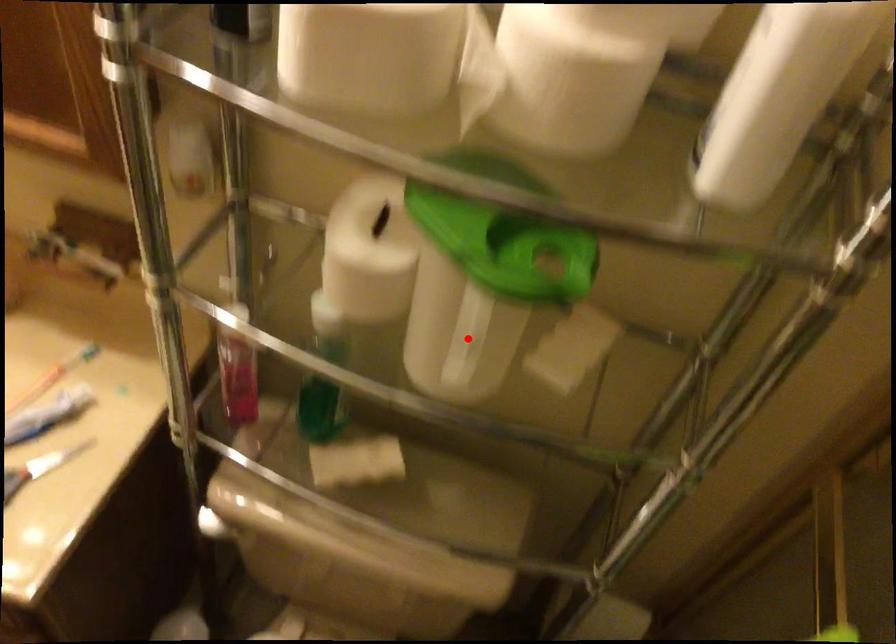
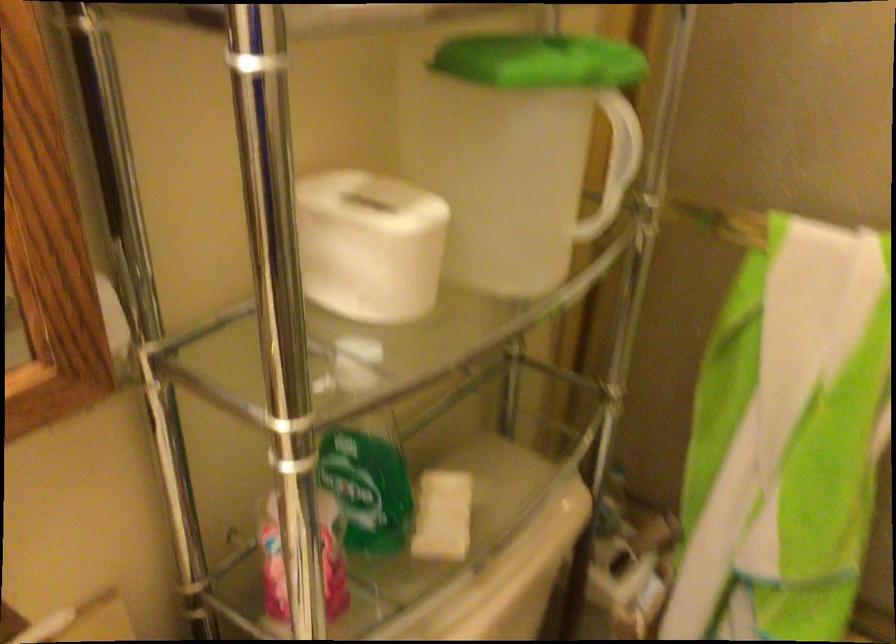
The point at the highlighted location is marked in the first image. Where is the corresponding point in the second image?

(618, 152)